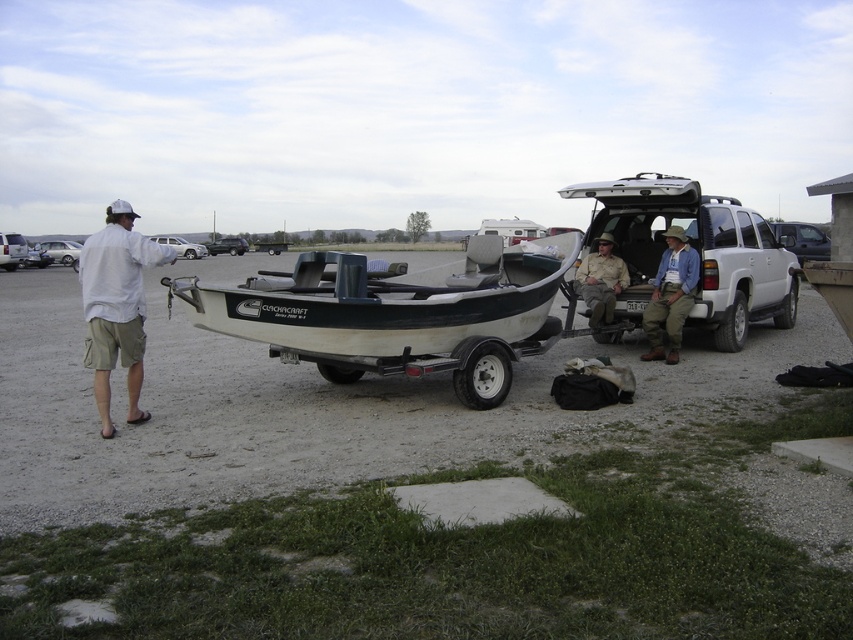
Which of these two, white fiberglass boat at center or white matte pickup truck at center, stands shorter?

Standing shorter between the two is white fiberglass boat at center.

Measure the distance between white fiberglass boat at center and camera.

7.05 meters

Is point (502, 252) behind point (579, 193)?

No, it is not.

What are the coordinates of `white fiberglass boat at center` in the screenshot? It's located at (401, 314).

Between white matte pickup truck at center and khaki pants at center, which one is positioned higher?

white matte pickup truck at center

Consider the image. Can you confirm if white matte pickup truck at center is positioned below khaki pants at center?

No.

The height and width of the screenshot is (640, 853). Describe the element at coordinates (695, 252) in the screenshot. I see `white matte pickup truck at center` at that location.

You are a GUI agent. You are given a task and a screenshot of the screen. Output one action in this format:
    pyautogui.click(x=<x>, y=<y>)
    Task: Click on the white matte pickup truck at center
    Image resolution: width=853 pixels, height=640 pixels.
    Given the screenshot: What is the action you would take?
    pyautogui.click(x=695, y=252)

Does white matte pickup truck at center have a greater width compared to white cotton shirt at left?

Correct, the width of white matte pickup truck at center exceeds that of white cotton shirt at left.

Consider the image. Who is more distant from viewer, (770, 305) or (146, 259)?

Point (770, 305)

The height and width of the screenshot is (640, 853). What are the coordinates of `white matte pickup truck at center` in the screenshot? It's located at (695, 252).